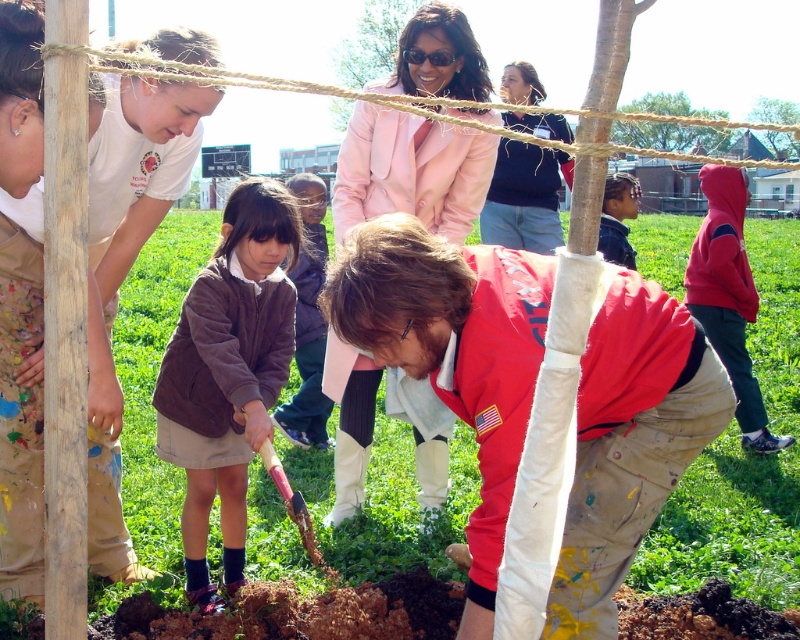
Looking at this image, is brown suede jacket at left taller than smooth wooden post at upper right?

Incorrect, brown suede jacket at left's height is not larger of smooth wooden post at upper right's.

Does point (100, 545) come farther from viewer compared to point (760, 99)?

No, (100, 545) is in front of (760, 99).

Locate an element on the screen. This screenshot has height=640, width=800. brown suede jacket at left is located at coordinates (20, 422).

Is smooth pink jacket at upper center thinner than dark brown hoodie at center?

In fact, smooth pink jacket at upper center might be wider than dark brown hoodie at center.

What do you see at coordinates (374, 42) in the screenshot? I see `smooth pink jacket at upper center` at bounding box center [374, 42].

Image resolution: width=800 pixels, height=640 pixels. What are the coordinates of `smooth pink jacket at upper center` in the screenshot? It's located at (374, 42).

Does red fleece hoodie at right have a lesser height compared to brown suede jacket at center?

Incorrect, red fleece hoodie at right's height does not fall short of brown suede jacket at center's.

Measure the distance between red fleece hoodie at right and brown suede jacket at center.

red fleece hoodie at right and brown suede jacket at center are 2.27 meters apart from each other.

Does point (700, 252) come in front of point (292, 429)?

No, it is not.

At what (x,y) coordinates should I click in order to perform the action: click on red fleece hoodie at right. Please return your answer as a coordinate pair (x, y). Looking at the image, I should click on (728, 298).